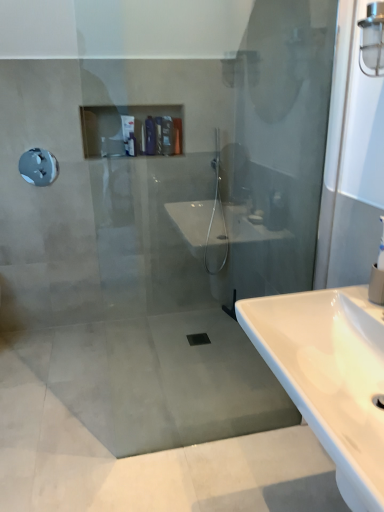
Question: From the image's perspective, is metallic gray showerhead at upper left located above or below clear glass light fixture at upper right?

Choices:
 (A) above
 (B) below

Answer: (B)

Question: Is metallic gray showerhead at upper left to the left or to the right of clear glass light fixture at upper right in the image?

Choices:
 (A) left
 (B) right

Answer: (A)

Question: Which is nearer to the matte plastic toiletries at upper center, the third toiletry when ordered from left to right?

Choices:
 (A) clear glass light fixture at upper right
 (B) white glossy sink at lower right
 (C) white glossy bottle at upper left, positioned as the 1th toiletry in left-to-right order
 (D) matte plastic shampoo bottle at upper center, marked as the 2th toiletry in a left-to-right arrangement
 (E) metallic gray showerhead at upper left

Answer: (D)

Question: Estimate the real-world distances between objects in this image. Which object is closer to the matte plastic shampoo bottle at upper center, placed as the second toiletry when sorted from right to left?

Choices:
 (A) metallic gray showerhead at upper left
 (B) white glossy bottle at upper left, which is the 3th toiletry from right to left
 (C) matte plastic toiletries at upper center, the third toiletry when ordered from left to right
 (D) clear glass light fixture at upper right
 (E) white glossy sink at lower right

Answer: (C)